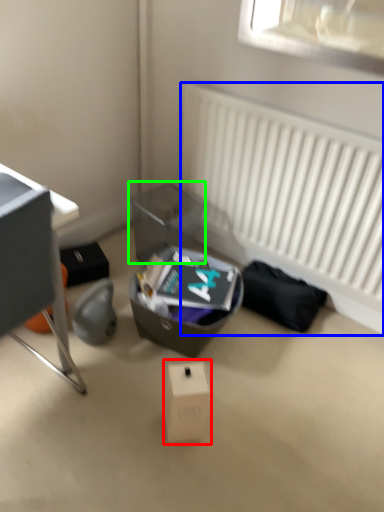
Question: Estimate the real-world distances between objects in this image. Which object is farther from cardboard box (highlighted by a red box), radiator (highlighted by a blue box) or shoe box (highlighted by a green box)?

Choices:
 (A) radiator
 (B) shoe box

Answer: (A)